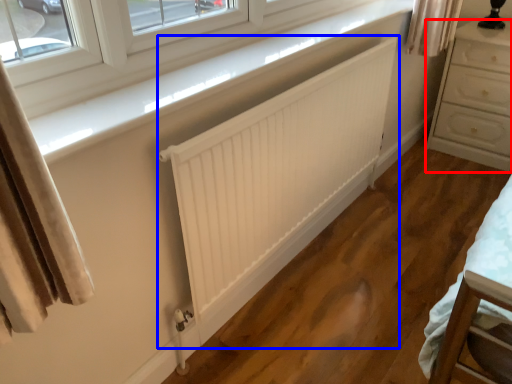
Question: Which point is closer to the camera, chest of drawers (highlighted by a red box) or radiator (highlighted by a blue box)?

Choices:
 (A) chest of drawers
 (B) radiator

Answer: (B)